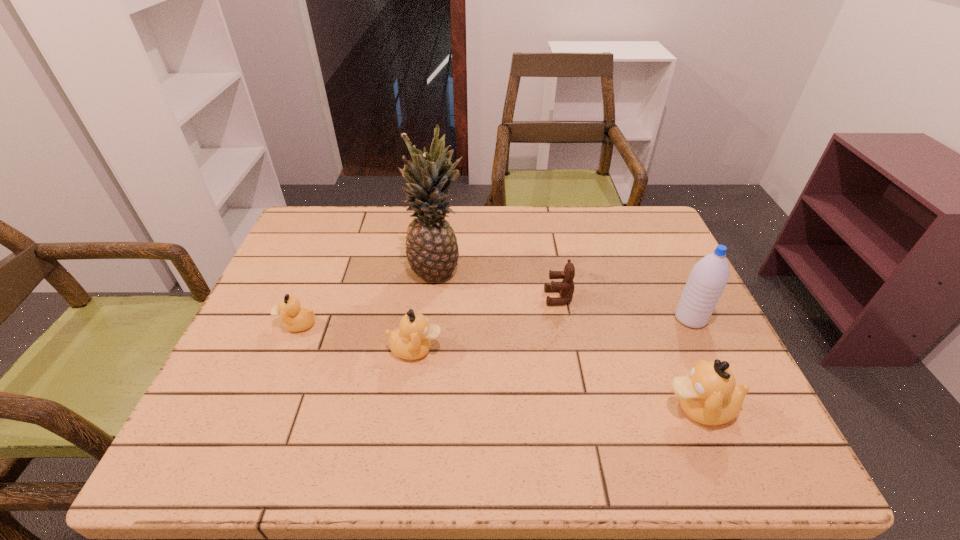
The height and width of the screenshot is (540, 960). What are the coordinates of `the third closest duckling to the pineapple` in the screenshot? It's located at (709, 395).

The width and height of the screenshot is (960, 540). What are the coordinates of `vacant region that satisfies the following two spatial constraints: 1. on the face of the teddy bear; 2. on the left side of the water bottle` in the screenshot? It's located at (563, 319).

Find the location of a particular element. This screenshot has height=540, width=960. free space that satisfies the following two spatial constraints: 1. on the front side of the water bottle; 2. on the face of the nearest object is located at coordinates (733, 408).